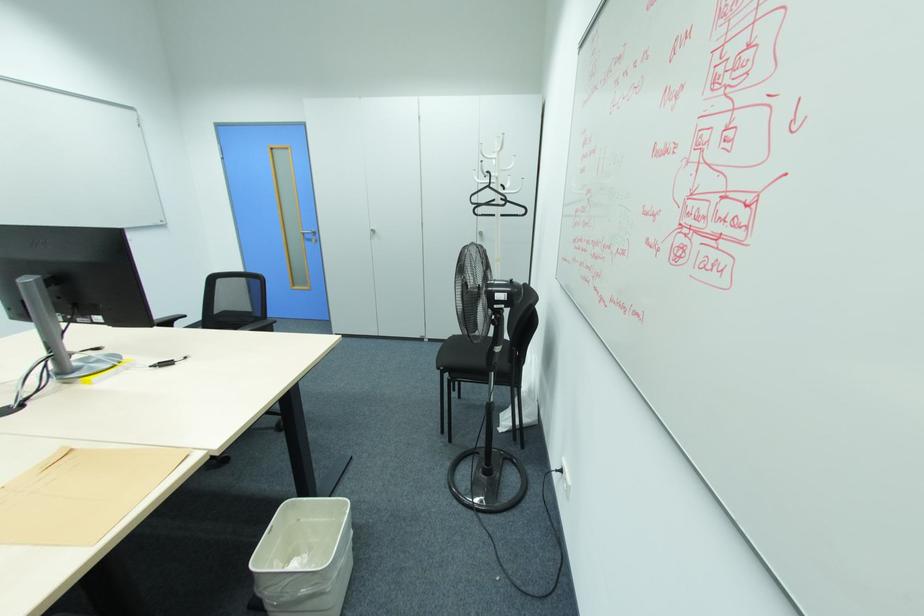
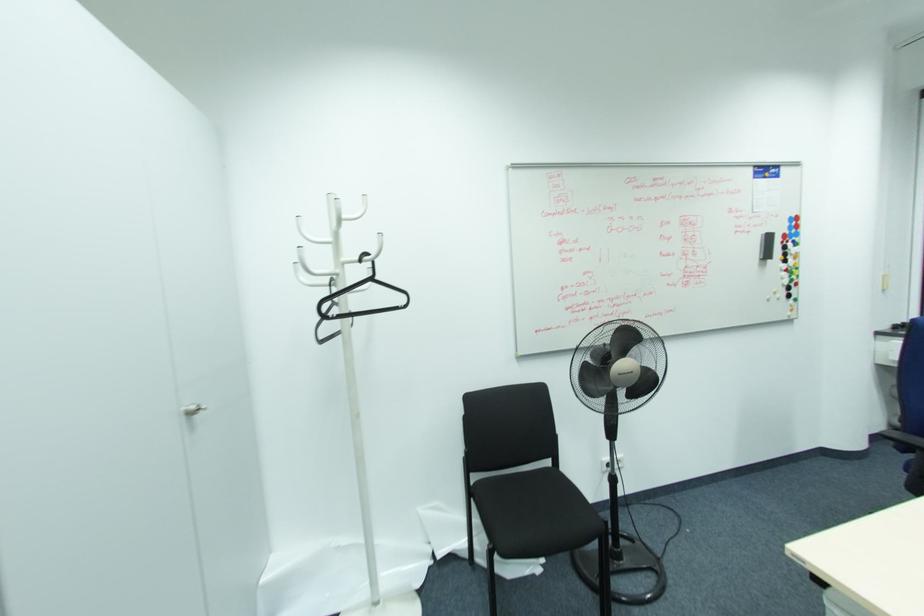
Locate, in the second image, the point that corresponds to [490,187] in the first image.

(371, 280)